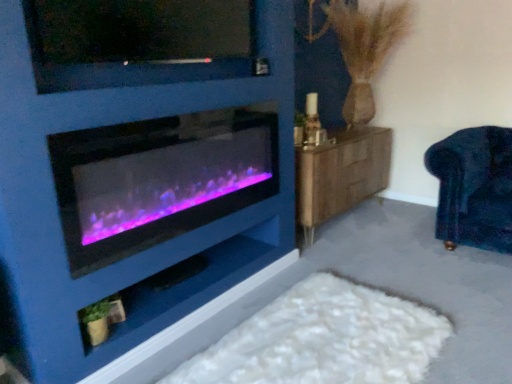
Question: From the image's perspective, is purple-lit glass wood burning stove at left beneath matte black shelf at lower center?

Choices:
 (A) yes
 (B) no

Answer: (B)

Question: Can you confirm if purple-lit glass wood burning stove at left is shorter than matte black shelf at lower center?

Choices:
 (A) yes
 (B) no

Answer: (B)

Question: Is purple-lit glass wood burning stove at left smaller than matte black shelf at lower center?

Choices:
 (A) no
 (B) yes

Answer: (A)

Question: Is purple-lit glass wood burning stove at left in contact with matte black shelf at lower center?

Choices:
 (A) yes
 (B) no

Answer: (B)

Question: From the image's perspective, is purple-lit glass wood burning stove at left above matte black shelf at lower center?

Choices:
 (A) no
 (B) yes

Answer: (B)

Question: In terms of height, does matte black shelf at lower center look taller or shorter compared to matte black tv at upper center?

Choices:
 (A) short
 (B) tall

Answer: (A)

Question: Is matte black shelf at lower center wider or thinner than matte black tv at upper center?

Choices:
 (A) thin
 (B) wide

Answer: (B)

Question: Is matte black shelf at lower center bigger or smaller than matte black tv at upper center?

Choices:
 (A) small
 (B) big

Answer: (A)

Question: Is matte black shelf at lower center in front of or behind matte black tv at upper center in the image?

Choices:
 (A) front
 (B) behind

Answer: (B)

Question: In terms of width, does velvet dark blue armchair at right look wider or thinner when compared to matte black shelf at lower center?

Choices:
 (A) wide
 (B) thin

Answer: (A)

Question: Considering the positions of point (478, 243) and point (142, 339), is point (478, 243) closer or farther from the camera than point (142, 339)?

Choices:
 (A) closer
 (B) farther

Answer: (B)

Question: Visually, is velvet dark blue armchair at right positioned to the left or to the right of matte black shelf at lower center?

Choices:
 (A) right
 (B) left

Answer: (A)

Question: Is velvet dark blue armchair at right bigger or smaller than matte black shelf at lower center?

Choices:
 (A) big
 (B) small

Answer: (A)

Question: Is wooden dresser at right to the left or to the right of matte black shelf at lower center in the image?

Choices:
 (A) right
 (B) left

Answer: (A)

Question: Which is correct: wooden dresser at right is inside matte black shelf at lower center, or outside of it?

Choices:
 (A) outside
 (B) inside

Answer: (A)